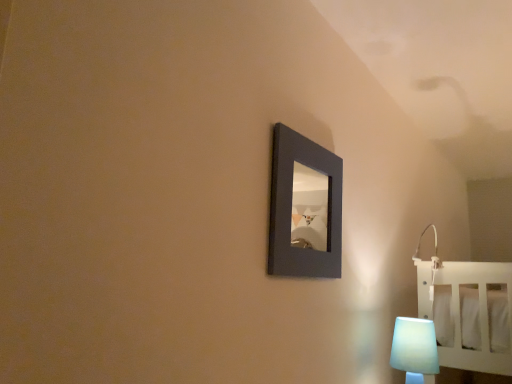
Question: Is translucent white lampshade at lower right closer to camera compared to matte black picture frame at center?

Choices:
 (A) no
 (B) yes

Answer: (A)

Question: Would you say translucent white lampshade at lower right contains matte black picture frame at center?

Choices:
 (A) yes
 (B) no

Answer: (B)

Question: Is translucent white lampshade at lower right behind matte black picture frame at center?

Choices:
 (A) yes
 (B) no

Answer: (A)

Question: From the image's perspective, does translucent white lampshade at lower right appear higher than matte black picture frame at center?

Choices:
 (A) no
 (B) yes

Answer: (A)

Question: Does translucent white lampshade at lower right appear on the right side of matte black picture frame at center?

Choices:
 (A) no
 (B) yes

Answer: (B)

Question: Does translucent white lampshade at lower right have a larger size compared to matte black picture frame at center?

Choices:
 (A) yes
 (B) no

Answer: (B)

Question: From the image's perspective, is matte black picture frame at center beneath translucent white lampshade at lower right?

Choices:
 (A) yes
 (B) no

Answer: (B)

Question: Is translucent white lampshade at lower right a part of matte black picture frame at center?

Choices:
 (A) yes
 (B) no

Answer: (B)

Question: Would you say matte black picture frame at center is outside translucent white lampshade at lower right?

Choices:
 (A) no
 (B) yes

Answer: (B)

Question: Is matte black picture frame at center thinner than translucent white lampshade at lower right?

Choices:
 (A) yes
 (B) no

Answer: (A)

Question: Does matte black picture frame at center appear on the left side of translucent white lampshade at lower right?

Choices:
 (A) yes
 (B) no

Answer: (A)

Question: Is matte black picture frame at center positioned before translucent white lampshade at lower right?

Choices:
 (A) yes
 (B) no

Answer: (A)

Question: Would you say translucent white lampshade at lower right is to the left or to the right of matte black picture frame at center in the picture?

Choices:
 (A) right
 (B) left

Answer: (A)